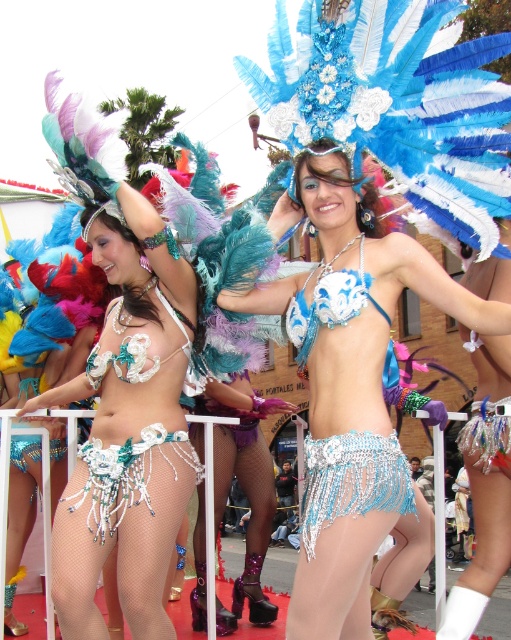
Can you confirm if shiny blue bikini at center is smaller than shiny silver bikini top at center?

No.

Which is more to the right, shiny blue bikini at center or shiny silver bikini top at center?

Positioned to the right is shiny silver bikini top at center.

You are a GUI agent. You are given a task and a screenshot of the screen. Output one action in this format:
    pyautogui.click(x=<x>, y=<y>)
    Task: Click on the shiny blue bikini at center
    
    Given the screenshot: What is the action you would take?
    pyautogui.click(x=359, y=301)

Measure the distance between matte silver bikini at center and shiny blue bikini at center.

matte silver bikini at center is 17.92 feet from shiny blue bikini at center.

Looking at this image, does matte silver bikini at center have a larger size compared to shiny blue bikini at center?

No, matte silver bikini at center is not bigger than shiny blue bikini at center.

The image size is (511, 640). What do you see at coordinates (127, 426) in the screenshot? I see `matte silver bikini at center` at bounding box center [127, 426].

Find the location of `matte silver bikini at center`. matte silver bikini at center is located at coordinates (127, 426).

Is matte silver bikini at center bigger than pearl beaded skirt at center?

Correct, matte silver bikini at center is larger in size than pearl beaded skirt at center.

Does matte silver bikini at center appear on the right side of pearl beaded skirt at center?

In fact, matte silver bikini at center is to the left of pearl beaded skirt at center.

Is point (126, 422) farther from viewer compared to point (99, 365)?

No, it is in front of (99, 365).

Locate an element on the screen. The height and width of the screenshot is (640, 511). matte silver bikini at center is located at coordinates (127, 426).